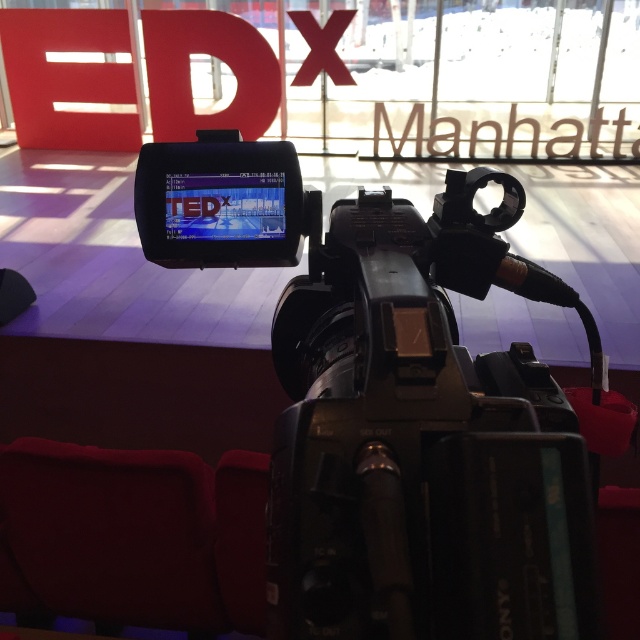
You are setting up a TEDx Manhattan event and need to position a speaker between the black plastic video camera at center and the velvet red chair at lower left. Based on the scene, where should the speaker stand to be centered between these two objects?

The speaker should stand to the right of the velvet red chair at lower left and to the left of the black plastic video camera at center since the camera is positioned to the right of the chair.

You are setting up a video conference and need to place a laptop between the black plastic video camera at center and the velvet red chair at lower left. The laptop is 30 centimeters long. Will there be enough space between them to fit the laptop?

The black plastic video camera at center and velvet red chair at lower left are 74.80 centimeters apart from each other. Since the laptop is 30 centimeters long, there is sufficient space between them to accommodate the laptop.

You are a technician adjusting the camera setup. You notice two points marked on the camera screen at coordinates point (576, 490) and point (156, 486). Which point is nearer to your line of sight?

Point (576, 490) is closer to the viewer than point (156, 486).